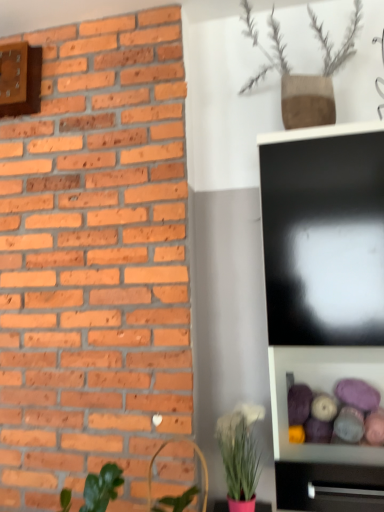
You are a GUI agent. You are given a task and a screenshot of the screen. Output one action in this format:
    pyautogui.click(x=<x>, y=<y>)
    Task: Click on the vacant space situated above black glossy tv cabinet at lower right (from a real-world perspective)
    The height and width of the screenshot is (512, 384).
    Given the screenshot: What is the action you would take?
    pyautogui.click(x=336, y=453)